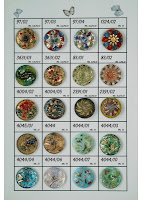
Identify the location of column. (31, 21), (55, 23), (84, 20), (114, 22).